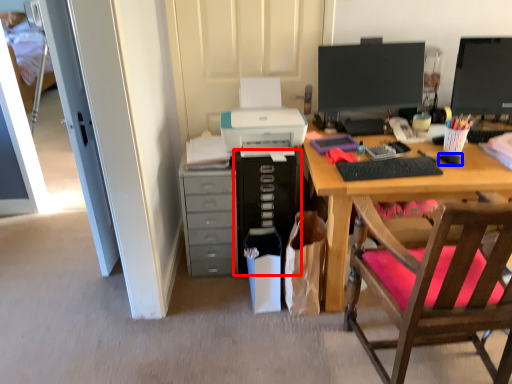
Question: Which object is closer to the camera taking this photo, computer tower (highlighted by a red box) or mouse (highlighted by a blue box)?

Choices:
 (A) computer tower
 (B) mouse

Answer: (B)